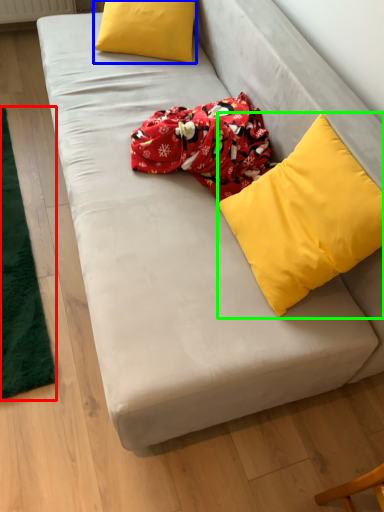
Question: Based on their relative distances, which object is nearer to mat (highlighted by a red box)? Choose from pillow (highlighted by a blue box) and pillow (highlighted by a green box).

Choices:
 (A) pillow
 (B) pillow

Answer: (A)